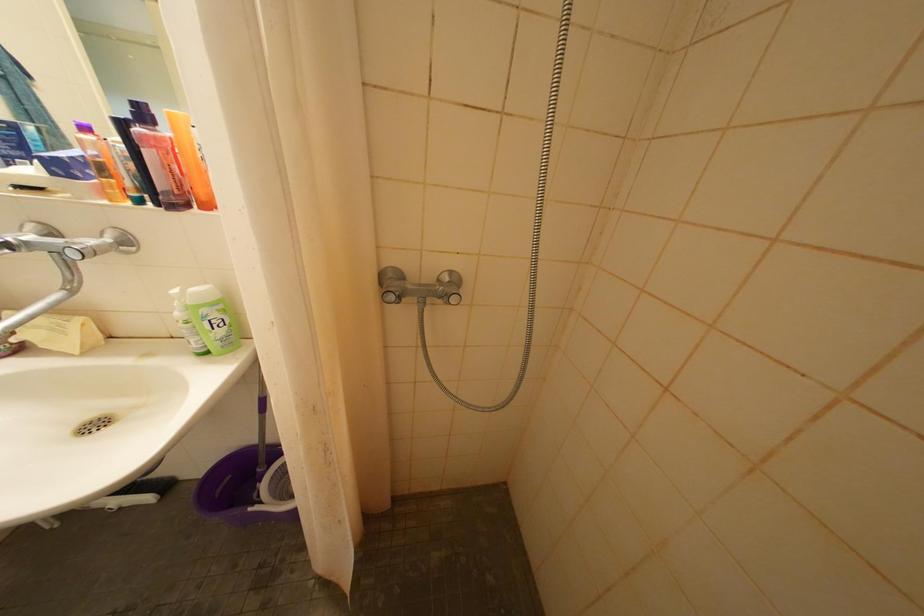
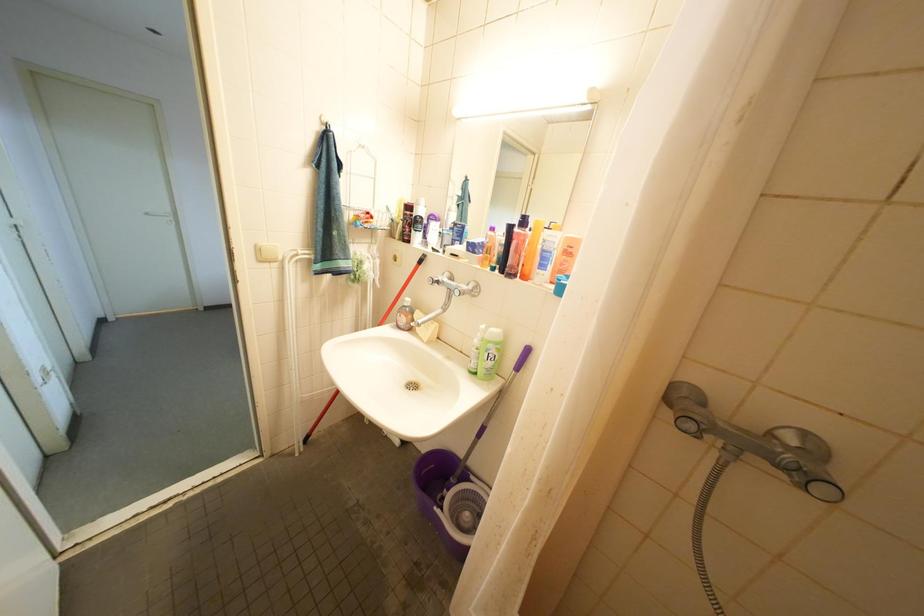
Question: Based on the continuous images, in which direction is the camera rotating? Reply with the corresponding letter.

Choices:
 (A) Left
 (B) Right
 (C) Up
 (D) Down

Answer: (A)